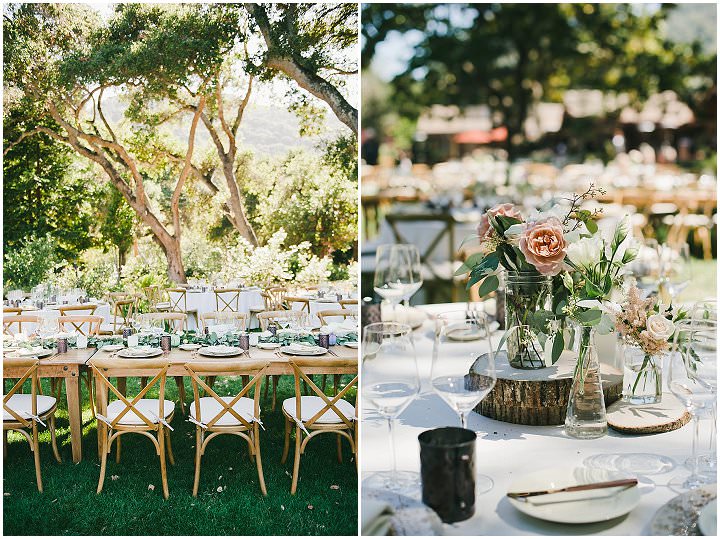
Locate an element on the screen. The image size is (720, 539). glass is located at coordinates (402, 376).